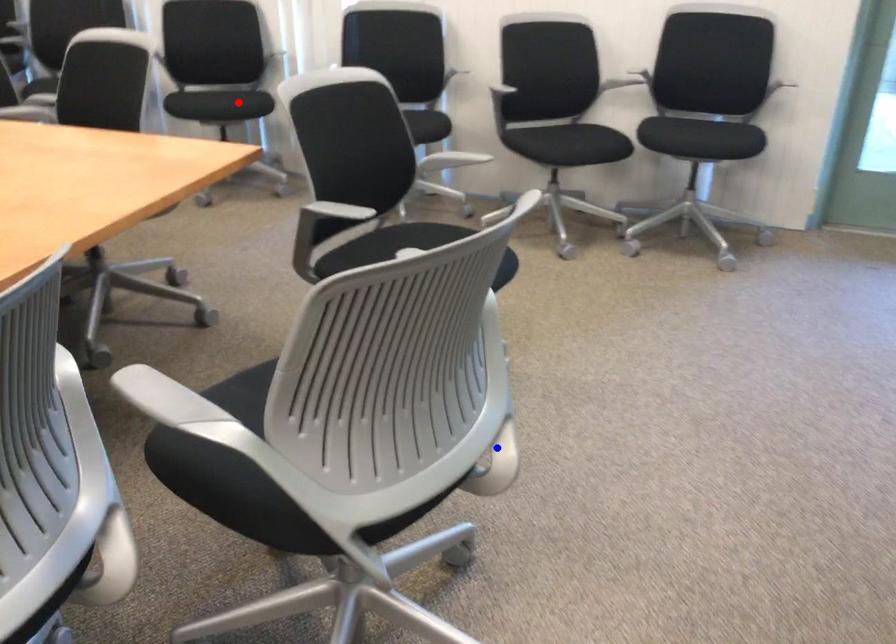
Question: In the image, two points are highlighted. Which point is nearer to the camera? Reply with the corresponding letter.

Choices:
 (A) blue point
 (B) red point

Answer: (A)